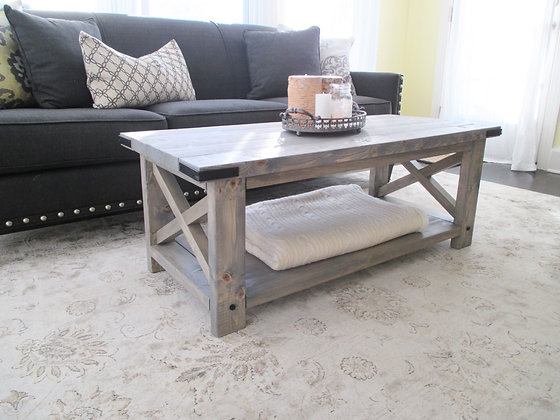
The image size is (560, 420). I want to click on table legs, so click(x=231, y=252), click(x=150, y=216), click(x=466, y=205), click(x=382, y=174).